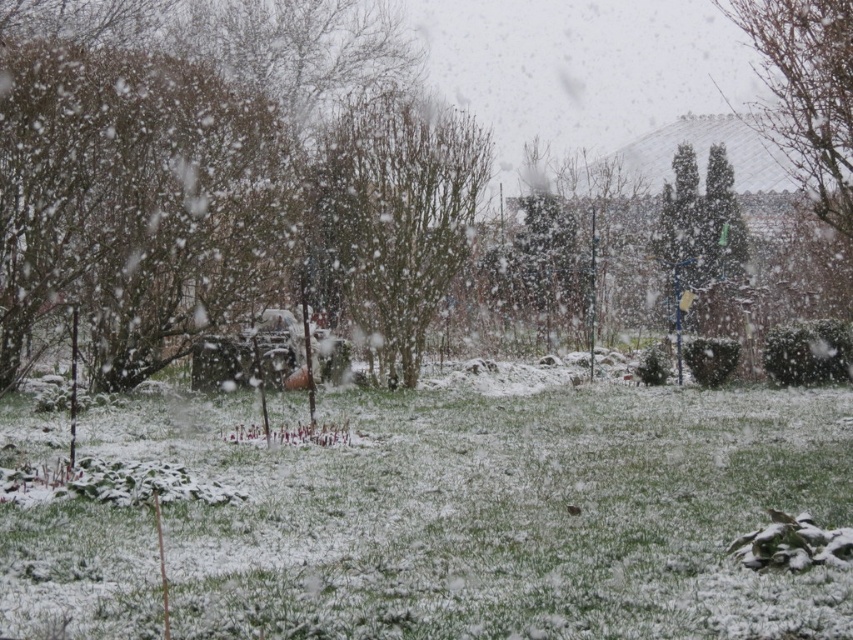
Who is lower down, white snow-covered grass at lower center or bare branches at center?

white snow-covered grass at lower center is lower down.

Who is more forward, (62, 609) or (489, 154)?

Point (62, 609)

Does point (439, 588) come farther from viewer compared to point (416, 358)?

No, (439, 588) is closer to viewer.

What are the coordinates of `white snow-covered grass at lower center` in the screenshot? It's located at (502, 515).